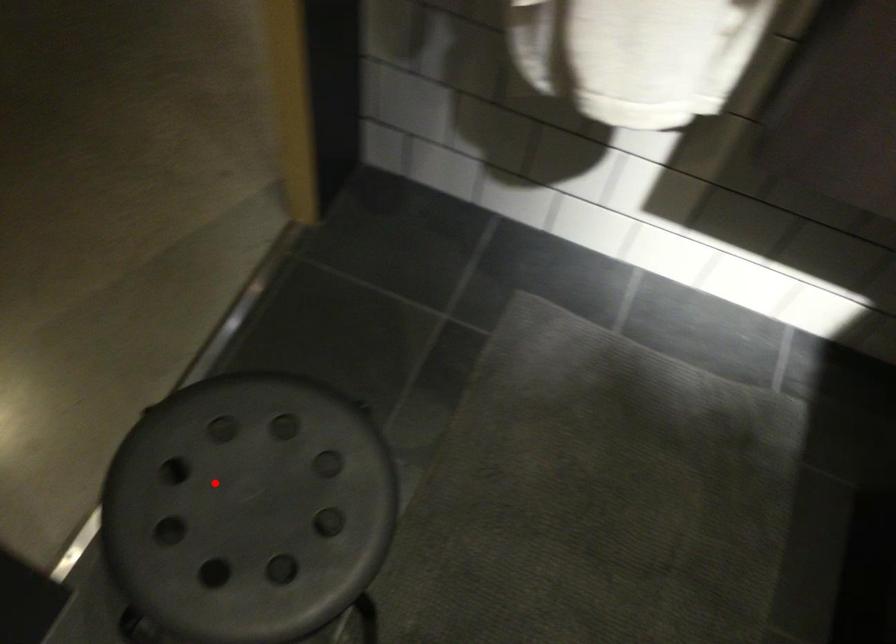
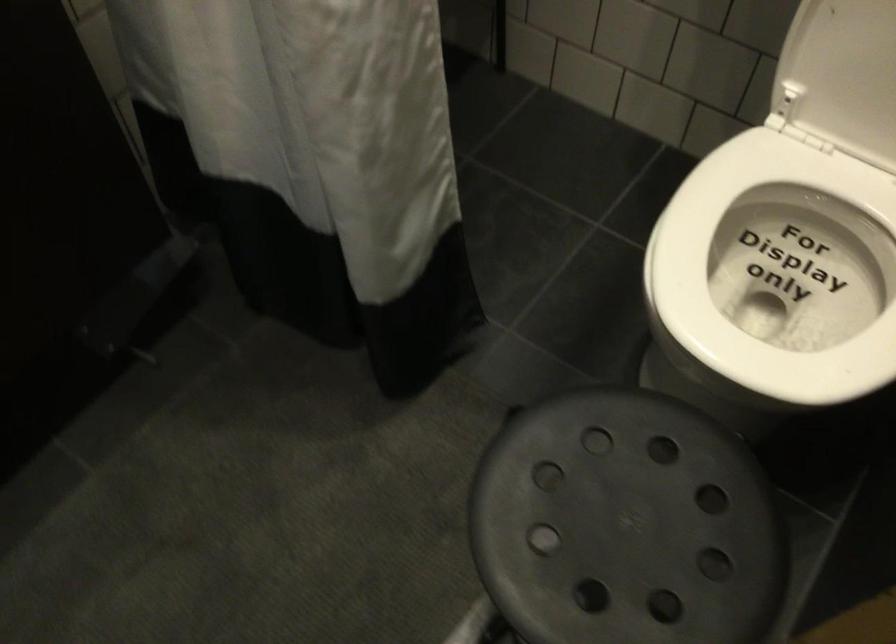
In the second image, find the point that corresponds to the highlighted location in the first image.

(625, 525)